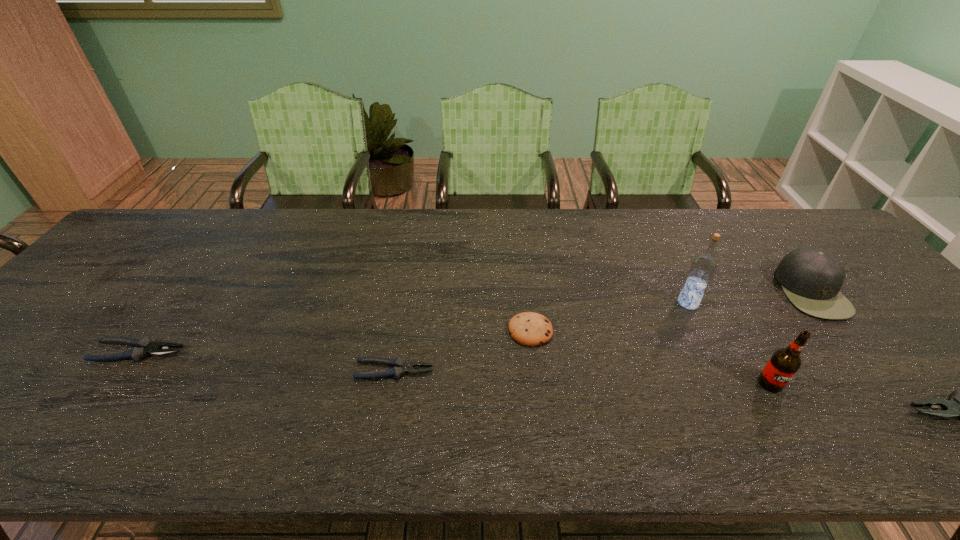
This screenshot has width=960, height=540. Find the location of `free space that satisfies the following two spatial constraints: 1. at the gripping part of the second pliers from right to left; 2. on the back side of the fifth object from left to right`. free space that satisfies the following two spatial constraints: 1. at the gripping part of the second pliers from right to left; 2. on the back side of the fifth object from left to right is located at coordinates (392, 383).